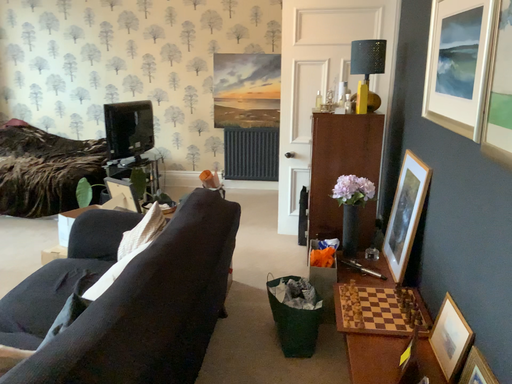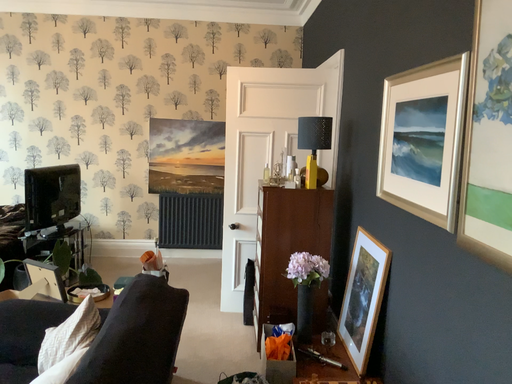
Question: How did the camera likely rotate when shooting the video?

Choices:
 (A) rotated downward
 (B) rotated upward

Answer: (B)